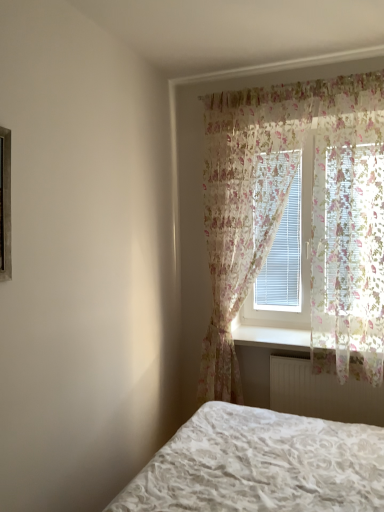
Question: Is floral sheer curtain at center, which appears as the 1th curtain when viewed from the left, wider than floral sheer curtain at upper right, which is counted as the second curtain, starting from the left?

Choices:
 (A) yes
 (B) no

Answer: (B)

Question: Is floral sheer curtain at center, which appears as the 1th curtain when viewed from the left, not near floral sheer curtain at upper right, which is counted as the second curtain, starting from the left?

Choices:
 (A) no
 (B) yes

Answer: (A)

Question: Is floral sheer curtain at center, which appears as the 1th curtain when viewed from the left, aimed at floral sheer curtain at upper right, which is counted as the second curtain, starting from the left?

Choices:
 (A) no
 (B) yes

Answer: (A)

Question: Is floral sheer curtain at center, which appears as the second curtain when viewed from the right, smaller than floral sheer curtain at upper right, arranged as the first curtain when viewed from the right?

Choices:
 (A) yes
 (B) no

Answer: (B)

Question: Does floral sheer curtain at center, which appears as the second curtain when viewed from the right, appear on the right side of floral sheer curtain at upper right, which is counted as the second curtain, starting from the left?

Choices:
 (A) no
 (B) yes

Answer: (A)

Question: From their relative heights in the image, would you say white plastic radiator at lower center is taller or shorter than floral sheer curtain at center, which appears as the 1th curtain when viewed from the left?

Choices:
 (A) tall
 (B) short

Answer: (B)

Question: Is white plastic radiator at lower center bigger or smaller than floral sheer curtain at center, which appears as the 1th curtain when viewed from the left?

Choices:
 (A) big
 (B) small

Answer: (B)

Question: In terms of width, does white plastic radiator at lower center look wider or thinner when compared to floral sheer curtain at center, which appears as the 1th curtain when viewed from the left?

Choices:
 (A) thin
 (B) wide

Answer: (B)

Question: Is white plastic radiator at lower center to the left or to the right of floral sheer curtain at center, which appears as the second curtain when viewed from the right, in the image?

Choices:
 (A) right
 (B) left

Answer: (A)

Question: Considering the positions of floral sheer curtain at center, which appears as the 1th curtain when viewed from the left, and white plastic radiator at lower center in the image, is floral sheer curtain at center, which appears as the 1th curtain when viewed from the left, bigger or smaller than white plastic radiator at lower center?

Choices:
 (A) big
 (B) small

Answer: (A)

Question: Considering the positions of floral sheer curtain at center, which appears as the second curtain when viewed from the right, and white plastic radiator at lower center in the image, is floral sheer curtain at center, which appears as the second curtain when viewed from the right, wider or thinner than white plastic radiator at lower center?

Choices:
 (A) wide
 (B) thin

Answer: (B)

Question: From their relative heights in the image, would you say floral sheer curtain at center, which appears as the 1th curtain when viewed from the left, is taller or shorter than white plastic radiator at lower center?

Choices:
 (A) tall
 (B) short

Answer: (A)

Question: From the image's perspective, is floral sheer curtain at center, which appears as the second curtain when viewed from the right, above or below white plastic radiator at lower center?

Choices:
 (A) below
 (B) above

Answer: (B)

Question: From the image's perspective, is floral sheer curtain at upper right, which is counted as the second curtain, starting from the left, positioned above or below floral sheer curtain at center, which appears as the 1th curtain when viewed from the left?

Choices:
 (A) below
 (B) above

Answer: (B)

Question: Considering the positions of point (350, 280) and point (345, 330), is point (350, 280) closer or farther from the camera than point (345, 330)?

Choices:
 (A) closer
 (B) farther

Answer: (A)